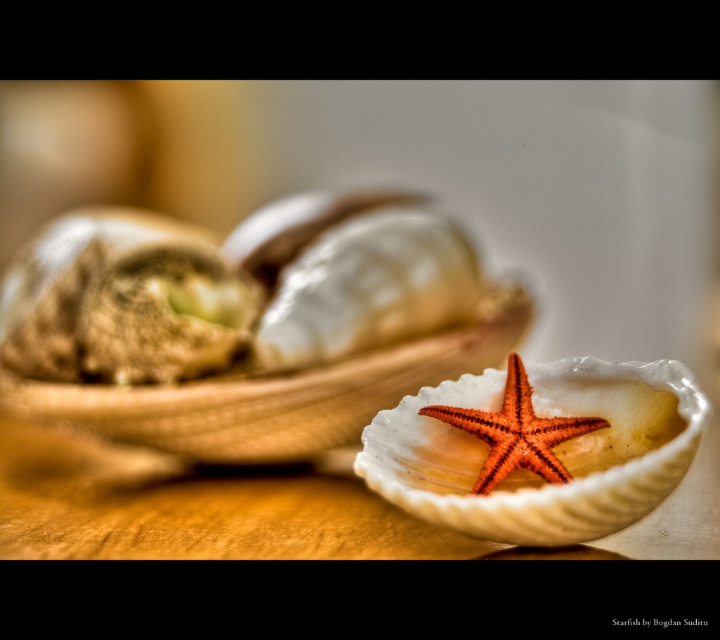
Can you confirm if white matte shellfish at center is shorter than smooth white shell at center?

Incorrect, white matte shellfish at center's height does not fall short of smooth white shell at center's.

How far apart are white matte shellfish at center and smooth white shell at center?

13.92 inches

Which is in front, point (107, 376) or point (459, 445)?

Positioned in front is point (459, 445).

Where is `white matte shellfish at center`? Image resolution: width=720 pixels, height=640 pixels. white matte shellfish at center is located at coordinates (243, 328).

Does smooth white shell at center appear over orange matte starfish at center?

No, smooth white shell at center is not above orange matte starfish at center.

Who is higher up, smooth white shell at center or orange matte starfish at center?

orange matte starfish at center is higher up.

Who is more forward, (386, 444) or (492, 429)?

Point (492, 429) is in front.

The width and height of the screenshot is (720, 640). Identify the location of smooth white shell at center. (553, 451).

Can you confirm if white matte shellfish at center is taller than orange matte starfish at center?

Yes, white matte shellfish at center is taller than orange matte starfish at center.

Between white matte shellfish at center and orange matte starfish at center, which one has less height?

orange matte starfish at center

Who is more forward, (130,214) or (571,433)?

Positioned in front is point (571,433).

Locate an element on the screen. This screenshot has width=720, height=640. white matte shellfish at center is located at coordinates (243, 328).